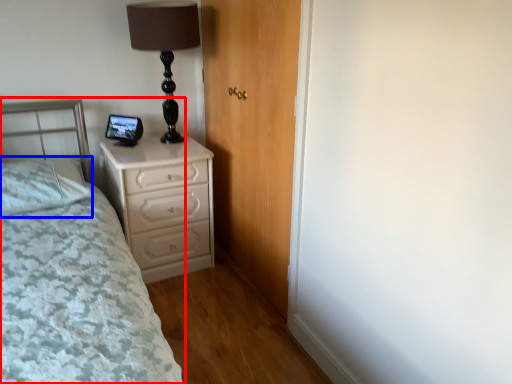
Question: Which object appears farthest to the camera in this image, bed (highlighted by a red box) or pillow (highlighted by a blue box)?

Choices:
 (A) bed
 (B) pillow

Answer: (B)